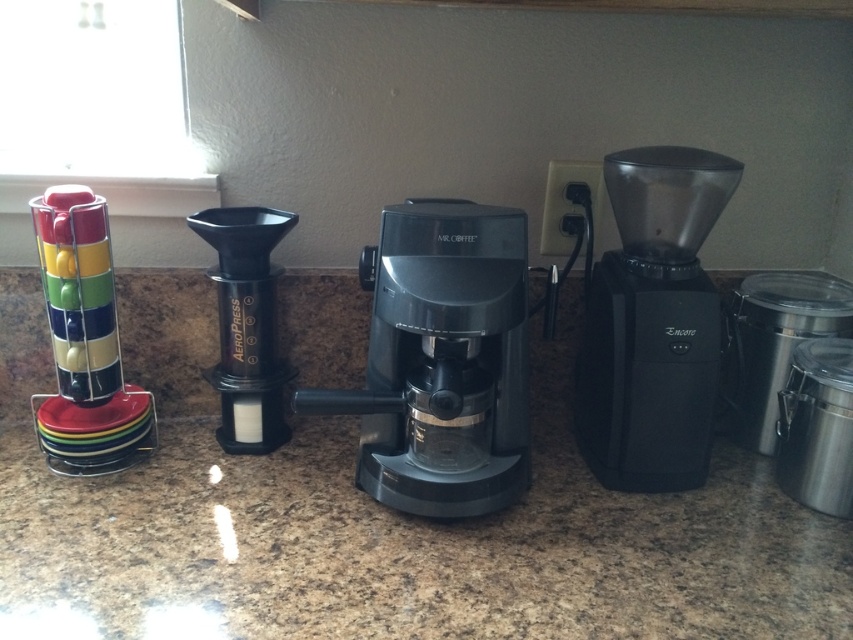
You are standing in front of the kitchen countertop and want to place a new coffee filter on the granite countertop at center and the black matte aeropress at center. Which surface is closer to you where you can place the filter more easily?

The granite countertop at center is closer to the viewer than the black matte aeropress at center, so you can place the coffee filter more easily on the granite countertop at center.

You are standing in front of the kitchen and want to place a 12 inch long coffee machine on the granite countertop at center. Can you fit it there?

The granite countertop at center is 26.59 inches from viewer, so yes, the 12 inch long coffee machine can fit on it since it is shorter than the available space.

You are making coffee and want to place the black matte aeropress at center on the granite countertop at center. Is there enough space for the aeropress to be placed on the countertop?

The granite countertop at center is below the black matte aeropress at center, which means the aeropress is already positioned on the countertop. Therefore, there is sufficient space for it to be placed there.